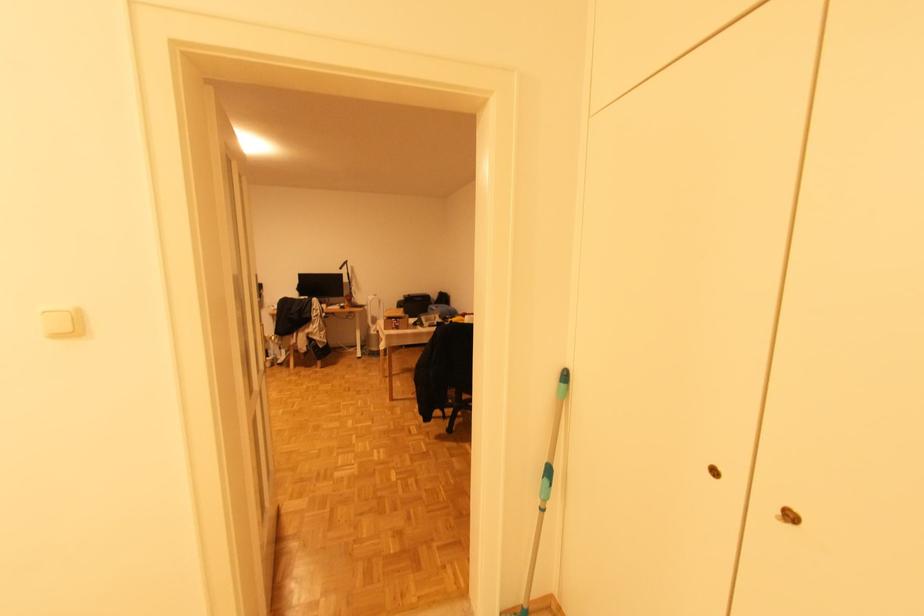
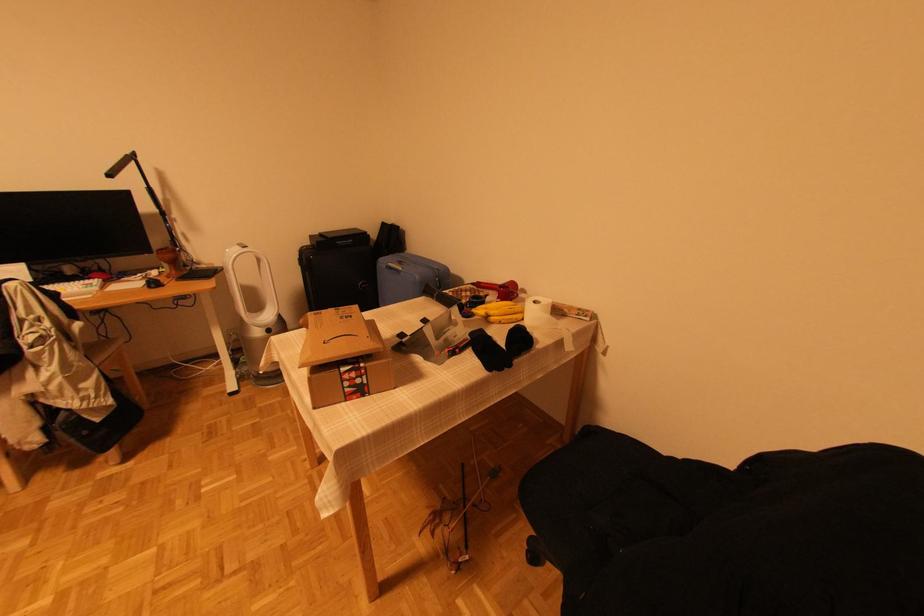
Locate, in the second image, the point that corresponds to [398,322] in the first image.

(356, 376)